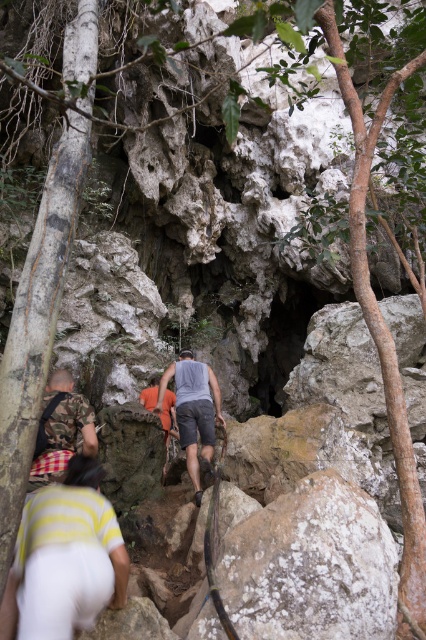
Can you confirm if yellow striped shirt at lower left is bigger than camo fabric shirt at lower left?

Actually, yellow striped shirt at lower left might be smaller than camo fabric shirt at lower left.

Does yellow striped shirt at lower left have a greater height compared to camo fabric shirt at lower left?

Correct, yellow striped shirt at lower left is much taller as camo fabric shirt at lower left.

Identify the location of yellow striped shirt at lower left. (66, 560).

Image resolution: width=426 pixels, height=640 pixels. In order to click on gray cotton tank top at center in this screenshot , I will do `click(193, 410)`.

Is gray cotton tank top at center to the left of camo fabric shirt at lower left from the viewer's perspective?

No, gray cotton tank top at center is not to the left of camo fabric shirt at lower left.

Between point (209, 461) and point (74, 438), which one is positioned behind?

The point (209, 461) is more distant.

Locate an element on the screen. gray cotton tank top at center is located at coordinates (193, 410).

Between yellow striped shirt at lower left and gray cotton tank top at center, which one appears on the left side from the viewer's perspective?

yellow striped shirt at lower left is more to the left.

Is yellow striped shirt at lower left above gray cotton tank top at center?

Actually, yellow striped shirt at lower left is below gray cotton tank top at center.

Is point (34, 516) closer to camera compared to point (204, 396)?

Yes.

You are a GUI agent. You are given a task and a screenshot of the screen. Output one action in this format:
    pyautogui.click(x=<x>, y=<y>)
    Task: Click on the yellow striped shirt at lower left
    The width and height of the screenshot is (426, 640).
    Given the screenshot: What is the action you would take?
    pyautogui.click(x=66, y=560)